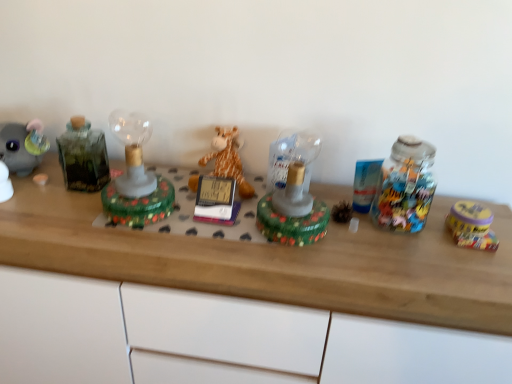
Question: In terms of width, does green glass lamp at center, which appears as the fourth toy when viewed from the right, look wider or thinner when compared to green glass bottle at left?

Choices:
 (A) wide
 (B) thin

Answer: (A)

Question: From the image's perspective, relative to green glass bottle at left, is green glass lamp at center, which appears as the fourth toy when viewed from the right, above or below?

Choices:
 (A) below
 (B) above

Answer: (A)

Question: Estimate the real-world distances between objects in this image. Which object is closer to the wooden desk at center?

Choices:
 (A) soft plush giraffe at center, arranged as the third toy when viewed from the right
 (B) translucent glass lamp at center, the 2th toy positioned from the right
 (C) yellow matte tin at right, acting as the 4th toy starting from the left
 (D) green glass lamp at center, which appears as the fourth toy when viewed from the right
 (E) green glass bottle at left

Answer: (B)

Question: Estimate the real-world distances between objects in this image. Which object is farther from the yellow matte tin at right, the first toy when ordered from right to left?

Choices:
 (A) green glass bottle at left
 (B) wooden desk at center
 (C) green glass lamp at center, the 1th toy in the left-to-right sequence
 (D) translucent glass lamp at center, the 2th toy positioned from the right
 (E) soft plush giraffe at center, the 2th toy viewed from the left

Answer: (A)